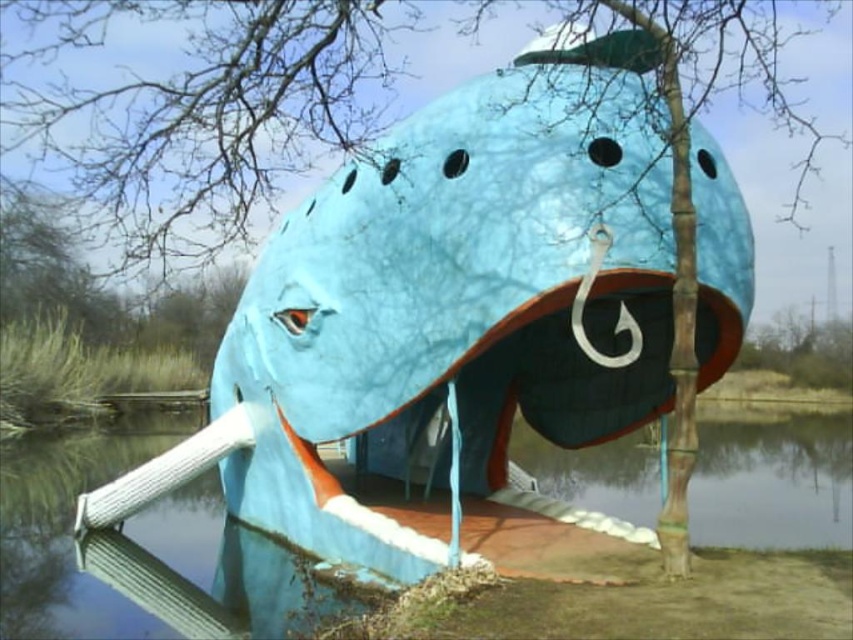
Is green bamboo tree at upper center in front of blue plastic water at lower center?

Yes.

Describe the element at coordinates (223, 100) in the screenshot. I see `green bamboo tree at upper center` at that location.

The image size is (853, 640). Identify the location of green bamboo tree at upper center. (223, 100).